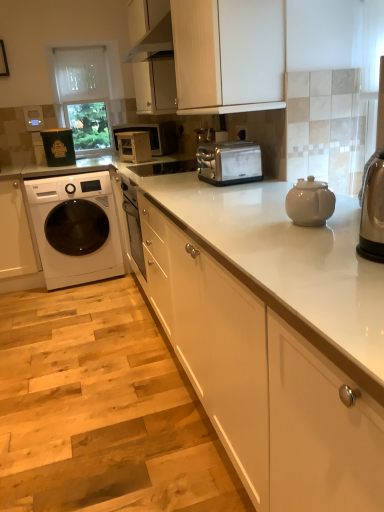
Question: Which is correct: matte white microwave at center is inside white glossy cabinet at left, positioned as the third cabinetry in right-to-left order, or outside of it?

Choices:
 (A) inside
 (B) outside

Answer: (B)

Question: In terms of size, does matte white microwave at center appear bigger or smaller than white glossy cabinet at left, marked as the first cabinetry in a left-to-right arrangement?

Choices:
 (A) small
 (B) big

Answer: (A)

Question: Estimate the real-world distances between objects in this image. Which object is farther from the transparent glass door at upper center, which appears as the 2th glass door when ordered from the bottom?

Choices:
 (A) satin silver microwave at center, the first appliance viewed from the right
 (B) transparent glass door at upper center, acting as the 1th glass door starting from the bottom
 (C) matte black container at left, the 2th appliance positioned from the right
 (D) matte white microwave at center
 (E) white glossy cabinet at left, marked as the first cabinetry in a left-to-right arrangement

Answer: (E)

Question: Which object is the farthest from the white glossy cabinet at left, positioned as the third cabinetry in right-to-left order?

Choices:
 (A) matte black container at left, the 2th appliance positioned from the right
 (B) transparent glass door at upper center, which appears as the 2th glass door when ordered from the bottom
 (C) white glossy washing machine at left
 (D) white matte cabinet at upper center, the 2th cabinetry in the right-to-left sequence
 (E) satin silver microwave at center, the first appliance viewed from the right

Answer: (D)